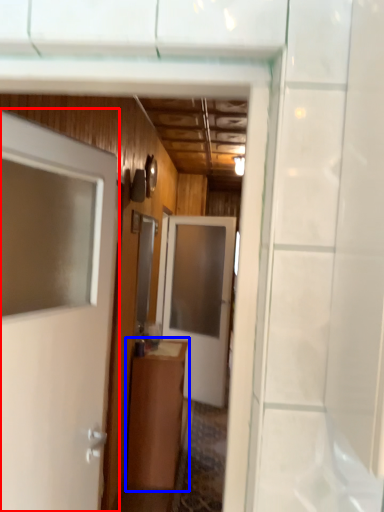
Question: Which object is closer to the camera taking this photo, door (highlighted by a red box) or cabinetry (highlighted by a blue box)?

Choices:
 (A) door
 (B) cabinetry

Answer: (A)